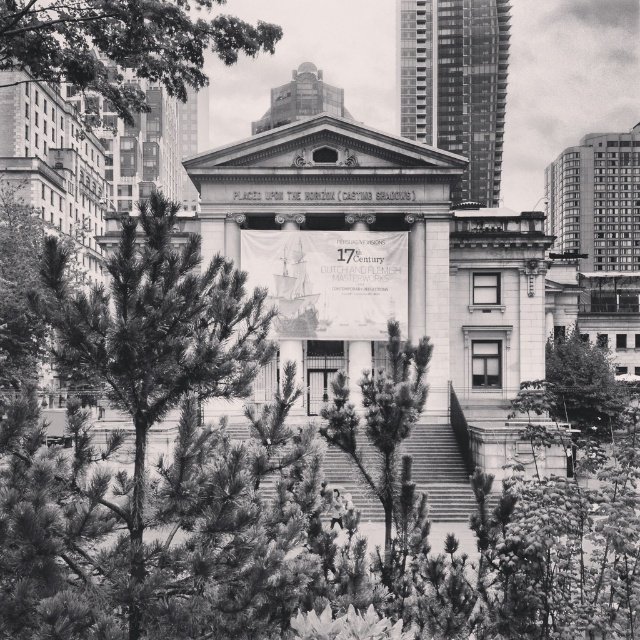
Question: Based on their relative distances, which object is farther from the green leafy tree at upper left?

Choices:
 (A) green leafy tree at center
 (B) needle-like foliage at center

Answer: (A)

Question: Does green leafy tree at upper left have a smaller size compared to needle-like pine at center?

Choices:
 (A) yes
 (B) no

Answer: (B)

Question: Among these objects, which one is farthest from the camera?

Choices:
 (A) green leafy tree at center
 (B) green leafy tree at upper left
 (C) needle-like pine at center
 (D) needle-like foliage at center

Answer: (A)

Question: Is green leafy tree at upper left further to the viewer compared to needle-like pine at center?

Choices:
 (A) yes
 (B) no

Answer: (A)

Question: Which point is farther from the camera taking this photo?

Choices:
 (A) (388, 417)
 (B) (176, 58)

Answer: (B)

Question: Does needle-like foliage at center appear on the right side of green leafy tree at center?

Choices:
 (A) no
 (B) yes

Answer: (A)